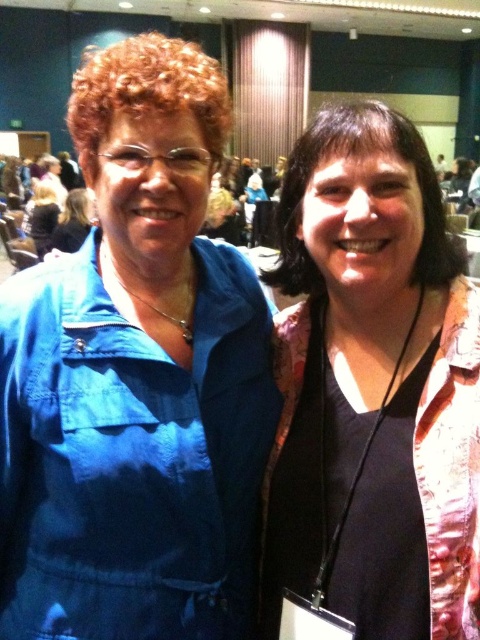
Does point (70, 368) come in front of point (282, 368)?

That is True.

Which is more to the right, denim jacket at left or matte black shirt at center?

matte black shirt at center

Measure the distance between denim jacket at left and camera.

30.31 inches

Where is `denim jacket at left`? The image size is (480, 640). denim jacket at left is located at coordinates click(x=136, y=378).